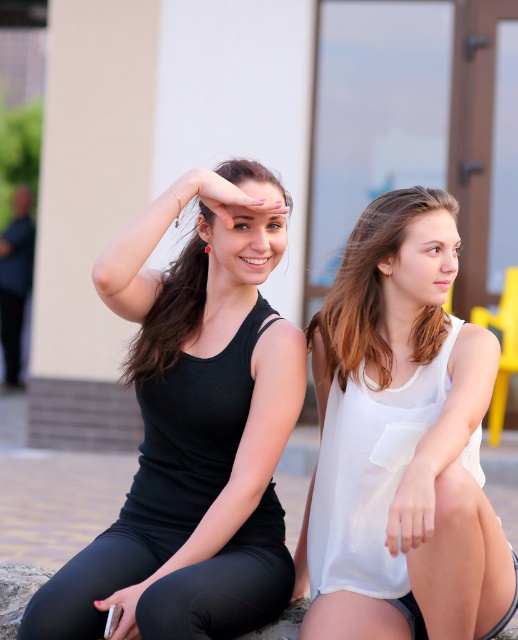
Question: Where is black matte tank top at left located in relation to matte black tank top at left in the image?

Choices:
 (A) right
 (B) left

Answer: (B)

Question: Which object is the closest to the matte black hand at upper center?

Choices:
 (A) black matte tank top at left
 (B) matte black tank top at left
 (C) matte black phone at lower left
 (D) white matte hand at lower right

Answer: (B)

Question: Is white matte hand at lower right positioned in front of matte black phone at lower left?

Choices:
 (A) no
 (B) yes

Answer: (B)

Question: Which object appears farthest from the camera in this image?

Choices:
 (A) matte black tank top at left
 (B) matte black hand at upper center
 (C) white matte hand at lower right
 (D) matte black phone at lower left

Answer: (A)

Question: Among these objects, which one is farthest from the camera?

Choices:
 (A) black matte tank top at left
 (B) matte black phone at lower left
 (C) light brown hair at right
 (D) white matte hand at lower right

Answer: (C)

Question: Can you confirm if white matte hand at lower right is thinner than matte black hand at upper center?

Choices:
 (A) yes
 (B) no

Answer: (A)